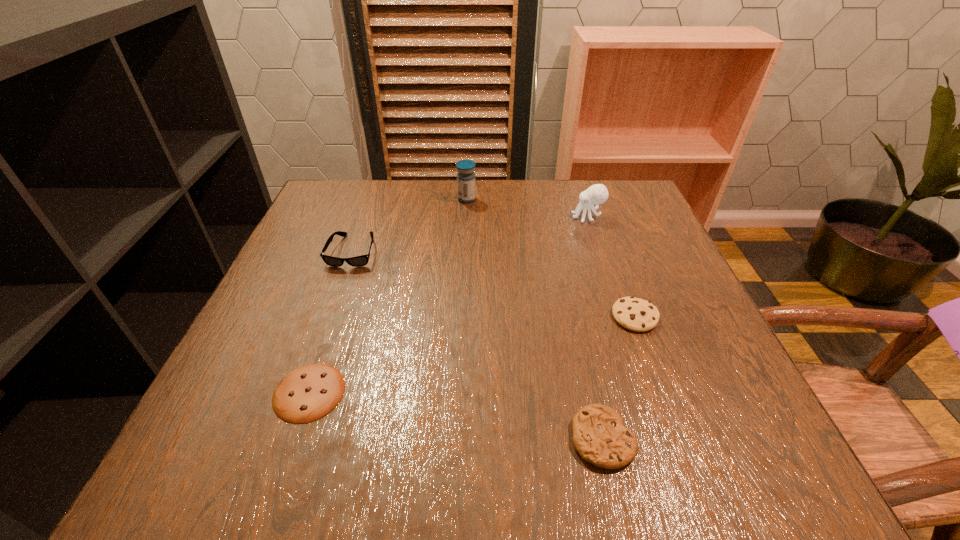
Where is `free space between the second cookie from left to right and the rightmost cookie`? free space between the second cookie from left to right and the rightmost cookie is located at coordinates (618, 377).

This screenshot has height=540, width=960. I want to click on vacant space that's between the medicine and the second cookie from left to right, so click(x=535, y=319).

In order to click on free area in between the fourth nearest object and the farthest object in this screenshot , I will do `click(410, 225)`.

This screenshot has height=540, width=960. What are the coordinates of `object that is the second closest to the shortest cookie` in the screenshot? It's located at (599, 436).

Locate an element on the screen. object that is the fifth closest to the farthest cookie is located at coordinates (358, 261).

Identify which cookie is the closest to the third farthest object. Please provide its 2D coordinates. Your answer should be formatted as a tuple, i.e. [(x, y)], where the tuple contains the x and y coordinates of a point satisfying the conditions above.

[(308, 393)]

You are a GUI agent. You are given a task and a screenshot of the screen. Output one action in this format:
    pyautogui.click(x=<x>, y=<y>)
    Task: Click on the cookie that is the closest one to the fifth nearest object
    The height and width of the screenshot is (540, 960).
    Given the screenshot: What is the action you would take?
    pos(635,314)

This screenshot has height=540, width=960. I want to click on free space that satisfies the following two spatial constraints: 1. on the front-facing side of the fourth object from left to right; 2. on the right side of the fourth nearest object, so pos(286,438).

The height and width of the screenshot is (540, 960). What are the coordinates of `free space that satisfies the following two spatial constraints: 1. on the back side of the fourth object from right to left; 2. on the left side of the leftmost cookie` in the screenshot? It's located at (375, 199).

At what (x,y) coordinates should I click in order to perform the action: click on vacant space that satisfies the following two spatial constraints: 1. on the front-facing side of the octopus; 2. on the front-facing side of the sunglasses. Please return your answer as a coordinate pair (x, y). This screenshot has height=540, width=960. Looking at the image, I should click on (599, 251).